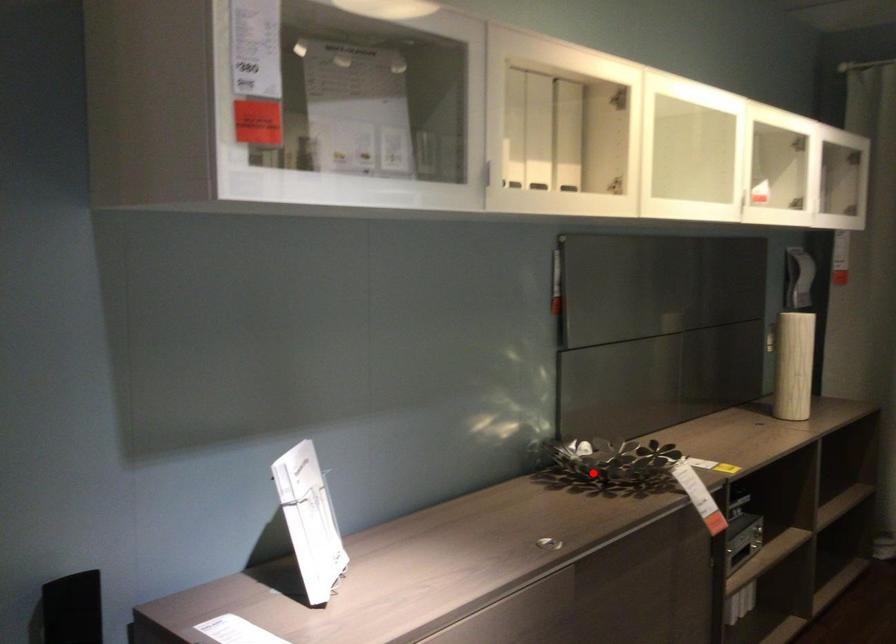
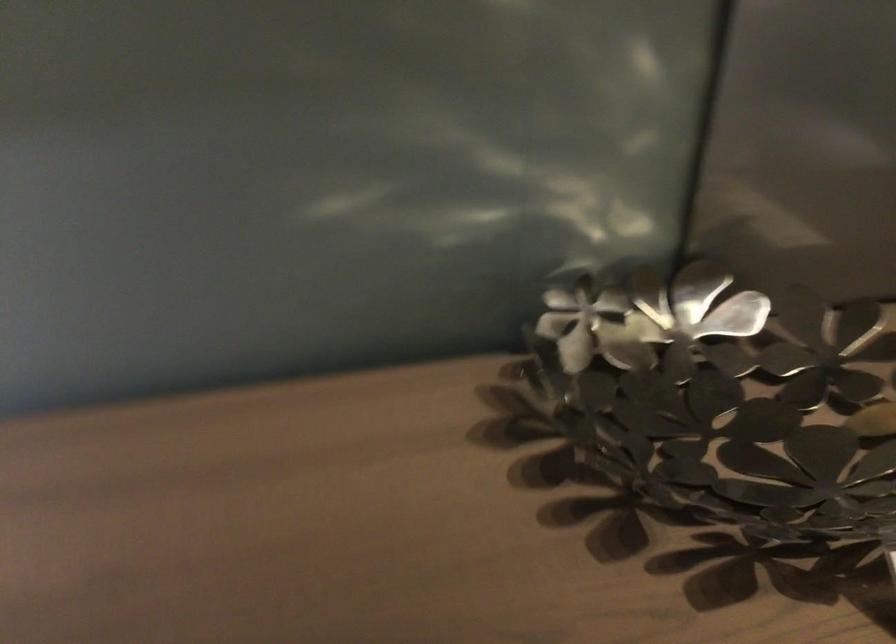
The point at the highlighted location is marked in the first image. Where is the corresponding point in the second image?

(721, 399)